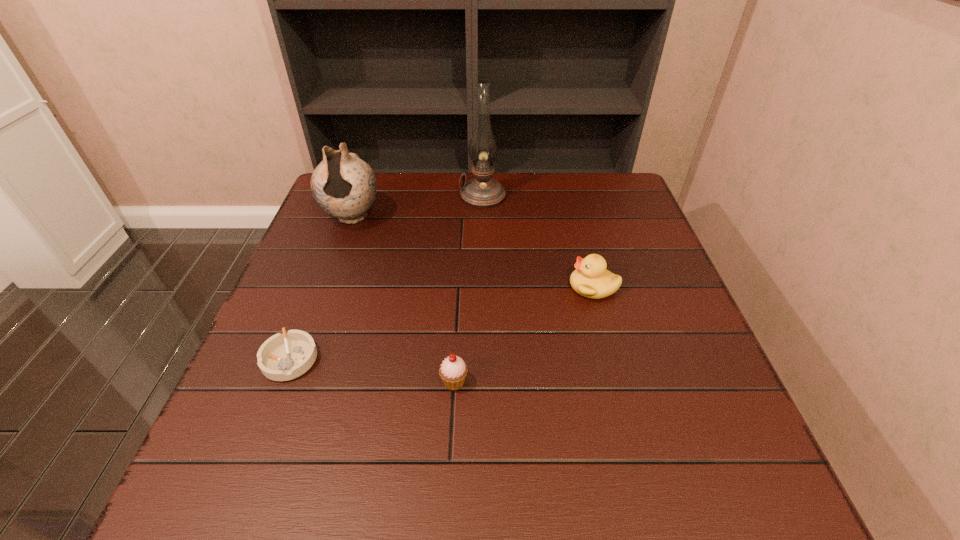
Locate an element on the screen. blank region between the rightmost object and the tallest object is located at coordinates (538, 241).

Where is `empty location between the oil lamp and the cupcake`? This screenshot has height=540, width=960. empty location between the oil lamp and the cupcake is located at coordinates (468, 289).

Image resolution: width=960 pixels, height=540 pixels. I want to click on empty location between the fourth shortest object and the shortest object, so click(x=321, y=287).

Locate an element on the screen. free spot between the fourth shortest object and the shortest object is located at coordinates (321, 287).

Choose which object is the fourth nearest neighbor to the second tallest object. Please provide its 2D coordinates. Your answer should be formatted as a tuple, i.e. [(x, y)], where the tuple contains the x and y coordinates of a point satisfying the conditions above.

[(590, 279)]

Locate which object is the closest to the shortest object. Please provide its 2D coordinates. Your answer should be formatted as a tuple, i.e. [(x, y)], where the tuple contains the x and y coordinates of a point satisfying the conditions above.

[(453, 370)]

This screenshot has height=540, width=960. Identify the location of free spot that satisfies the following two spatial constraints: 1. from the spout of the cupcake; 2. on the left side of the second tallest object. [x=291, y=381].